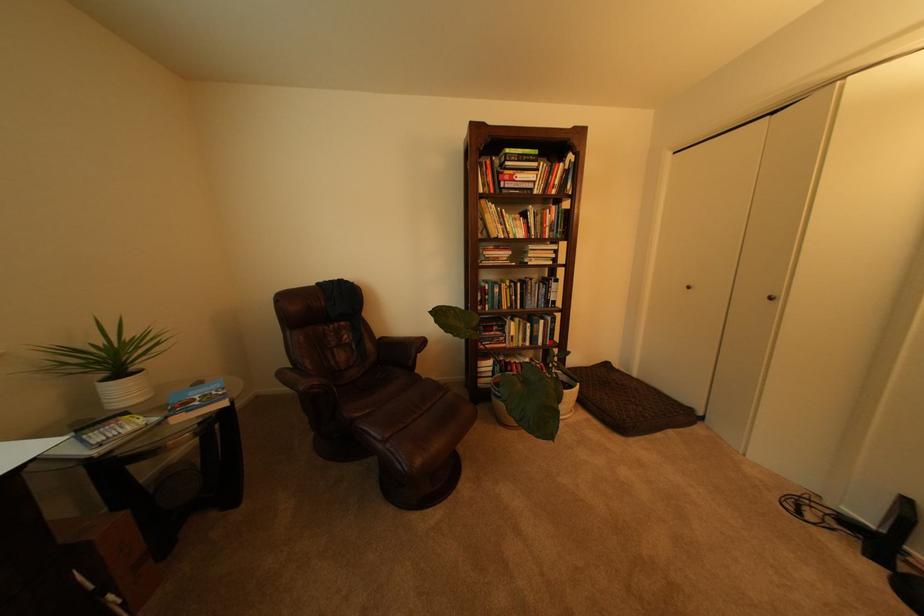
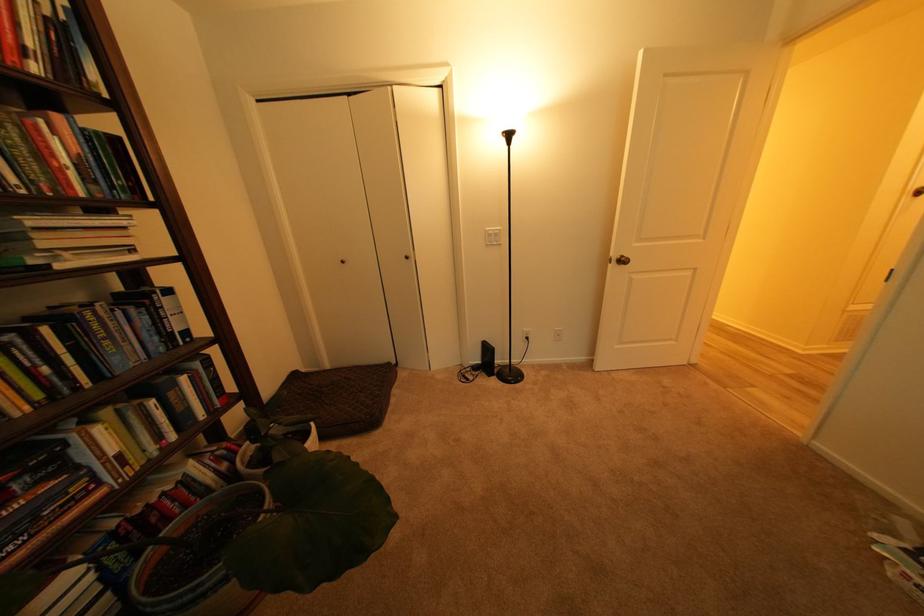
Find the pixel in the second image that matches point (525, 342) in the first image.

(141, 463)